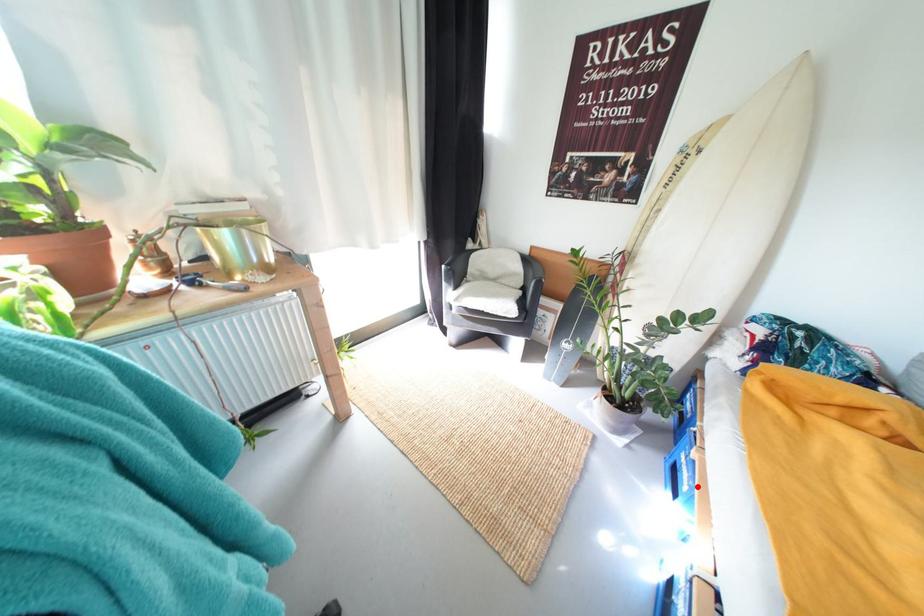
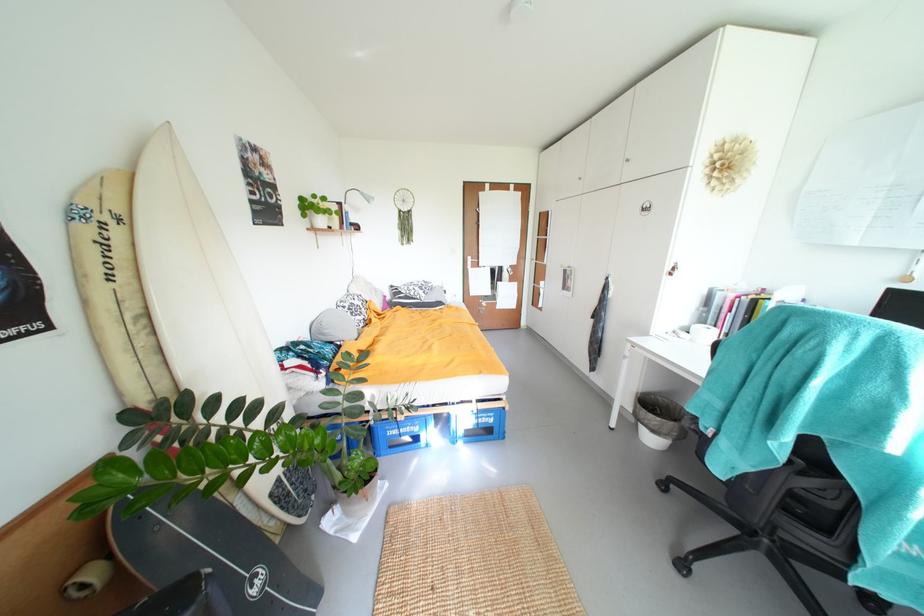
Question: I am providing you with two images of the same scene from different viewpoints. A red point is shown in image1. For the corresponding object point in image2, is it positioned nearer or farther from the camera?

Choices:
 (A) Nearer
 (B) Farther

Answer: (B)